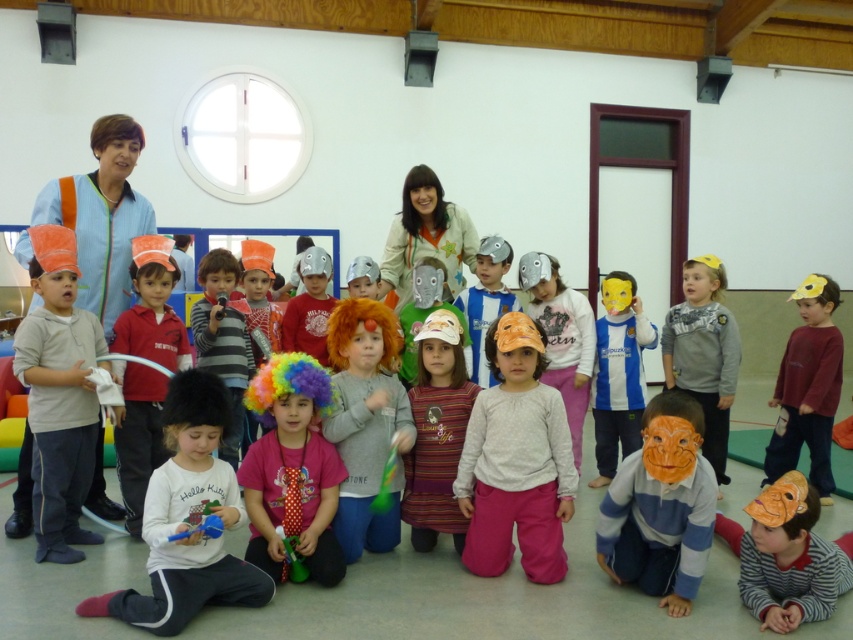
You are organizing a costume party and need to decide which item to place first in the display case. The orange paper mask at lower center and the orange matte hat at center are both candidates. Based on their sizes, which one should you place first to ensure it fits properly?

The orange paper mask at lower center is larger than the orange matte hat at center, so you should place the orange paper mask at lower center first to ensure it fits properly in the display case.

You are a photographer trying to capture a group photo of the children in the scene. The multicolored fluffy wig at center and the matte yellow mask at center are two key elements you want in the photo. Given that your camera has a maximum focus range of 2 meters, will you be able to capture both elements clearly in the same photo without moving the children?

The multicolored fluffy wig at center and the matte yellow mask at center are 2.31 meters apart. Since the camera can only focus up to 2 meters, the distance between them exceeds the focus range. Therefore, you cannot capture both clearly in the same photo without moving the children.

You are a photographer standing at the center of the room. You want to take a photo of the orange paper mask at lower right and the matte orange wig at center. How far apart are these two objects from each other?

The orange paper mask at lower right is 1.96 meters from matte orange wig at center.